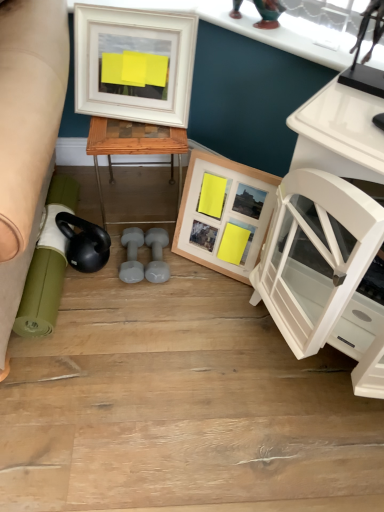
You are a GUI agent. You are given a task and a screenshot of the screen. Output one action in this format:
    pyautogui.click(x=<x>, y=<y>)
    Task: Click on the vacant space to the right of gray rubber dumbbell at center, acting as the 2th dumbbell starting from the left
    
    Given the screenshot: What is the action you would take?
    pyautogui.click(x=202, y=275)